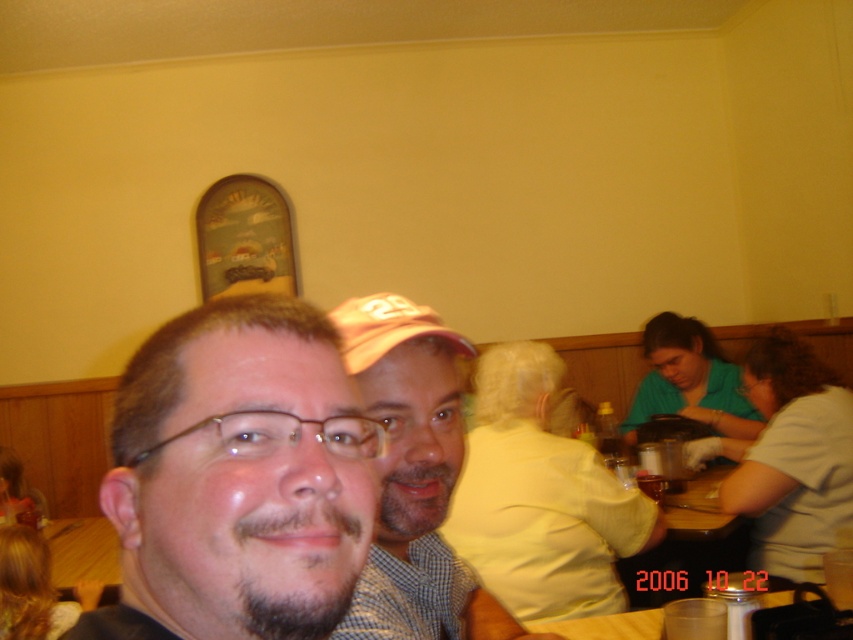
Can you confirm if matte black shirt at left is bigger than checkered fabric shirt at center?

Actually, matte black shirt at left might be smaller than checkered fabric shirt at center.

Is matte black shirt at left above checkered fabric shirt at center?

Indeed, matte black shirt at left is positioned over checkered fabric shirt at center.

Where is `matte black shirt at left`? The width and height of the screenshot is (853, 640). matte black shirt at left is located at coordinates (236, 477).